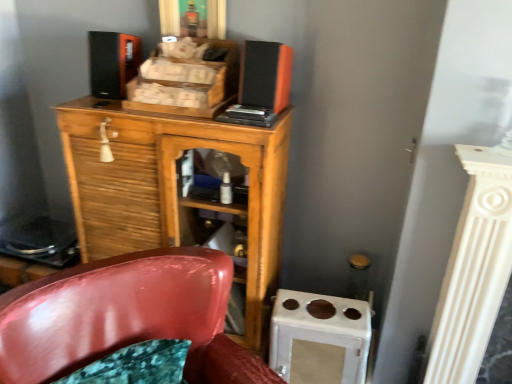
Question: Considering the positions of glossy plastic chair at lower left and matte black speaker at upper left, the second speaker positioned from the right, in the image, is glossy plastic chair at lower left bigger or smaller than matte black speaker at upper left, the second speaker positioned from the right,?

Choices:
 (A) big
 (B) small

Answer: (A)

Question: In the image, is glossy plastic chair at lower left positioned in front of or behind matte black speaker at upper left, the second speaker positioned from the right?

Choices:
 (A) front
 (B) behind

Answer: (A)

Question: Which of these objects is positioned closest to the matte black speaker at upper center, positioned as the second speaker in left-to-right order?

Choices:
 (A) matte black speaker at upper left, the 1th speaker in the left-to-right sequence
 (B) glossy plastic chair at lower left
 (C) wooden cabinet at center

Answer: (C)

Question: Which is farther from the glossy plastic chair at lower left?

Choices:
 (A) matte black speaker at upper center, positioned as the second speaker in left-to-right order
 (B) matte black speaker at upper left, the 1th speaker in the left-to-right sequence
 (C) wooden cabinet at center

Answer: (B)